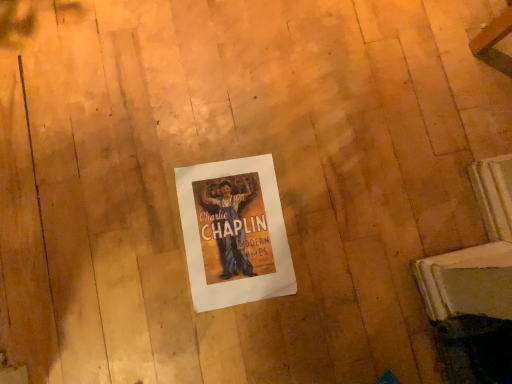
Find the location of a particular element. This screenshot has width=512, height=384. free space in front of white paper poster at center is located at coordinates (147, 302).